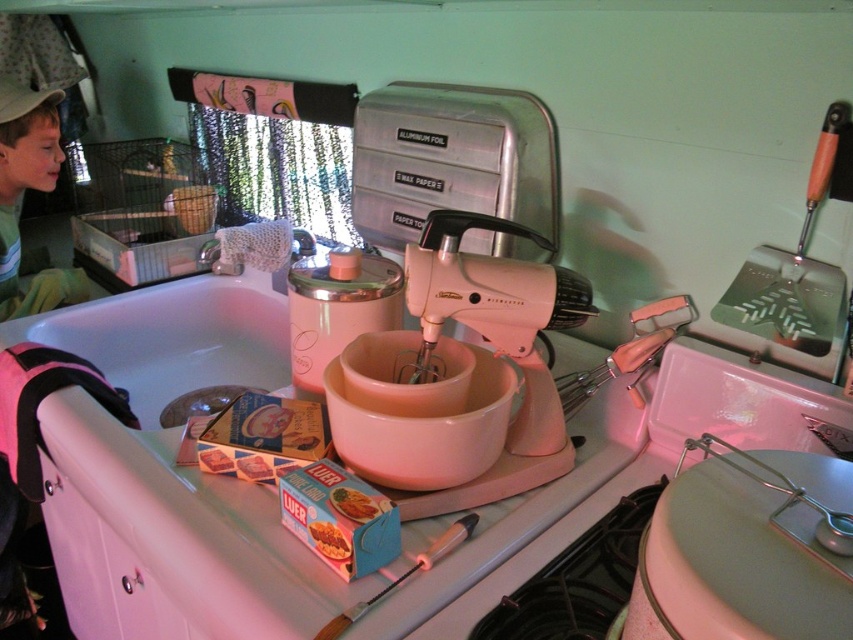
Question: Considering the relative positions of matte cardboard box of luer at center and smooth cardboard box of spaghetti at lower center in the image provided, where is matte cardboard box of luer at center located with respect to smooth cardboard box of spaghetti at lower center?

Choices:
 (A) below
 (B) above

Answer: (B)

Question: From the image, what is the correct spatial relationship of green cotton shirt at upper left in relation to matte cardboard box of luer at center?

Choices:
 (A) above
 (B) below

Answer: (A)

Question: Among these objects, which one is nearest to the camera?

Choices:
 (A) matte cardboard box of luer at center
 (B) smooth cardboard box of spaghetti at lower center
 (C) green cotton shirt at upper left
 (D) pink plastic mixer at center

Answer: (B)

Question: Among these points, which one is nearest to the camera?

Choices:
 (A) (535, 467)
 (B) (16, 272)
 (C) (338, 499)

Answer: (C)

Question: Which object appears closest to the camera in this image?

Choices:
 (A) matte cardboard box of luer at center
 (B) green cotton shirt at upper left
 (C) pink plastic mixer at center
 (D) smooth cardboard box of spaghetti at lower center

Answer: (D)

Question: In this image, where is green cotton shirt at upper left located relative to smooth cardboard box of spaghetti at lower center?

Choices:
 (A) left
 (B) right

Answer: (A)